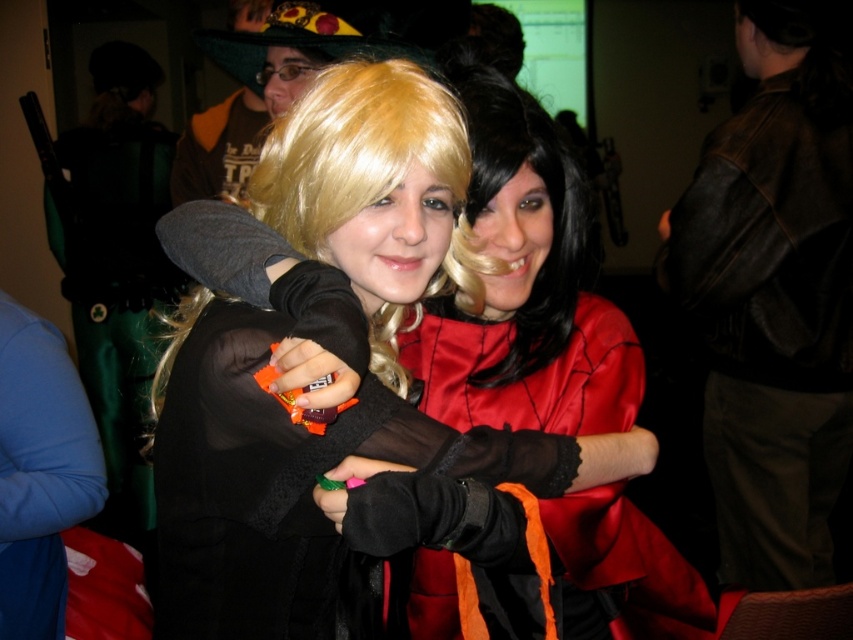
Based on the photo, you are a photographer at the event and want to position a spotlight exactly at the center of the shiny satin dress at center. According to the coordinates provided, where should you aim the spotlight?

The spotlight should be aimed at the coordinates point (524,291) since that is the 2D location of the shiny satin dress at center.

You are a photographer at a costume party and need to decide which item to adjust first for better lighting. Since the shiny satin dress at center and velvet black gloves at center are both in the frame, which one requires more light because of its material?

The shiny satin dress at center requires more light because it is made of reflective material and is larger in size than the velvet black gloves at center, making it stand out more in the lighting setup.